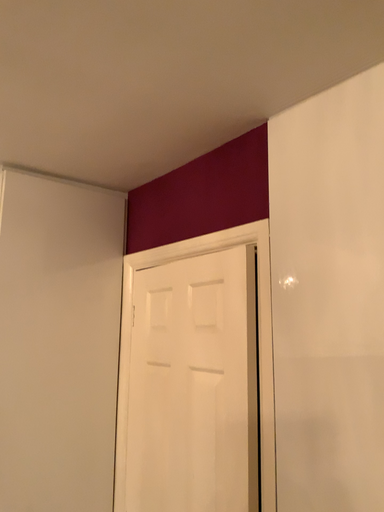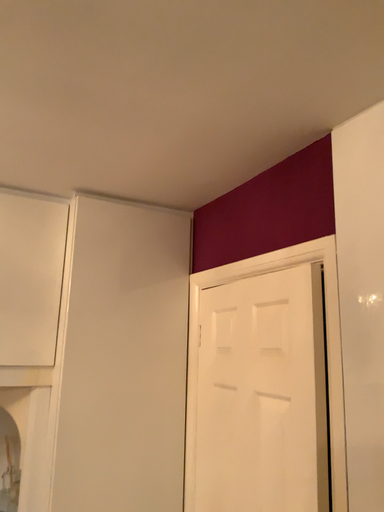
Question: How did the camera likely rotate when shooting the video?

Choices:
 (A) rotated left
 (B) rotated right

Answer: (A)